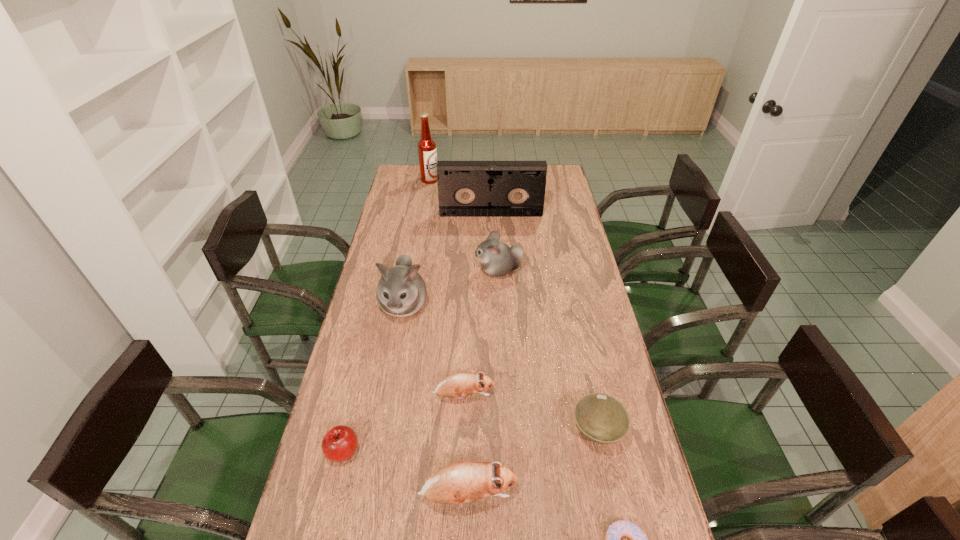
Where is `apple`? The width and height of the screenshot is (960, 540). apple is located at coordinates (340, 442).

Find the location of a particular element. This screenshot has height=540, width=960. the smaller brown hamster is located at coordinates (457, 385).

Where is `the shortest hamster`? This screenshot has height=540, width=960. the shortest hamster is located at coordinates (457, 385).

What are the coordinates of `bowl` in the screenshot? It's located at (601, 418).

Where is `gray bowl`? gray bowl is located at coordinates (601, 418).

The height and width of the screenshot is (540, 960). I want to click on vacant point located 0.310m on the label side of the farthest object, so click(x=500, y=180).

Where is `vacant space situated 0.310m on the front side of the eighth nearest object`? The image size is (960, 540). vacant space situated 0.310m on the front side of the eighth nearest object is located at coordinates (492, 261).

You are a GUI agent. You are given a task and a screenshot of the screen. Output one action in this format:
    pyautogui.click(x=<x>, y=<y>)
    Task: Click on the free point located on the face of the nearer white hamster
    This screenshot has height=540, width=960.
    Given the screenshot: What is the action you would take?
    click(387, 399)

The height and width of the screenshot is (540, 960). Find the location of `vacant area situated 0.330m on the face of the right white hamster`. vacant area situated 0.330m on the face of the right white hamster is located at coordinates (390, 271).

Where is `free space located 0.290m on the face of the right white hamster`? The height and width of the screenshot is (540, 960). free space located 0.290m on the face of the right white hamster is located at coordinates (400, 271).